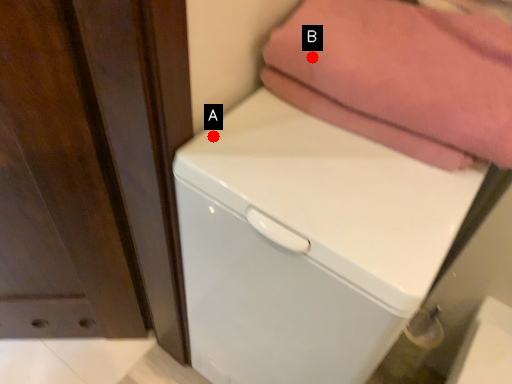
Question: Two points are circled on the image, labeled by A and B beside each circle. Which point is closer to the camera?

Choices:
 (A) A is closer
 (B) B is closer

Answer: (B)